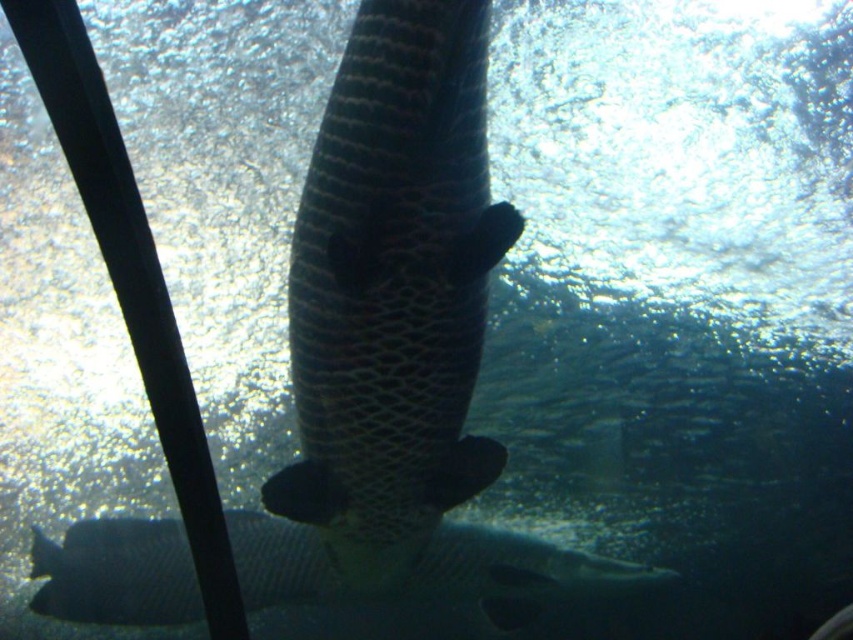
You are an underwater photographer aiming to capture both the dark textured fish at center and the dark gray textured fish at lower center in a single frame. Which fish should you focus on first to ensure both are in the frame?

The dark textured fish at center is smaller in size compared to the dark gray textured fish at lower center. Therefore, you should focus on the dark gray textured fish at lower center first to ensure both fit within the frame.

You are a marine biologist studying underwater life. You observe a point at coordinates point (393,289) in the image. Based on the scene description, what object is this point located on?

The point (393,289) is located on the dark textured fish at center.

Looking at this image, you are a diver trying to locate two points underwater. The first point is at coordinates point (x=515, y=211) and the second is at point (x=587, y=572). Which point is closer to you?

Point (x=515, y=211) is closer to the camera than point (x=587, y=572), so the first point is closer to you.